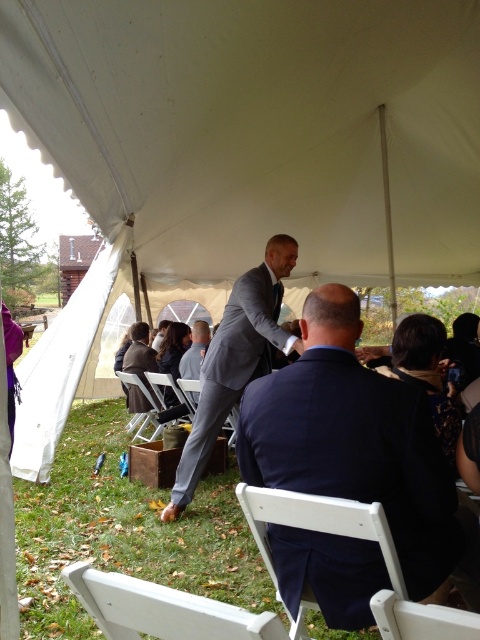
Between point (324, 524) and point (144, 372), which one is positioned behind?

The point (144, 372) is more distant.

Find the location of a particular element. white wood chair at lower center is located at coordinates (325, 532).

Between navy blue suit at center and white plastic chair at lower left, which one is positioned lower?

white plastic chair at lower left is below.

What do you see at coordinates (354, 440) in the screenshot? I see `navy blue suit at center` at bounding box center [354, 440].

Locate an element on the screen. navy blue suit at center is located at coordinates (354, 440).

Does white plastic chair at lower center lie in front of gray suit at center?

Yes, it is in front of gray suit at center.

Is white plastic chair at lower center above gray suit at center?

Actually, white plastic chair at lower center is below gray suit at center.

I want to click on white plastic chair at lower center, so click(162, 609).